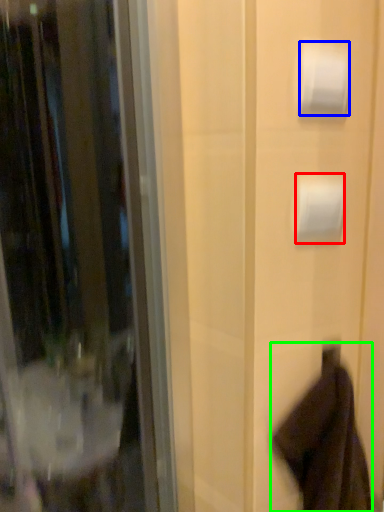
Question: Estimate the real-world distances between objects in this image. Which object is closer to toilet paper (highlighted by a red box), toilet paper (highlighted by a blue box) or robe (highlighted by a green box)?

Choices:
 (A) toilet paper
 (B) robe

Answer: (A)